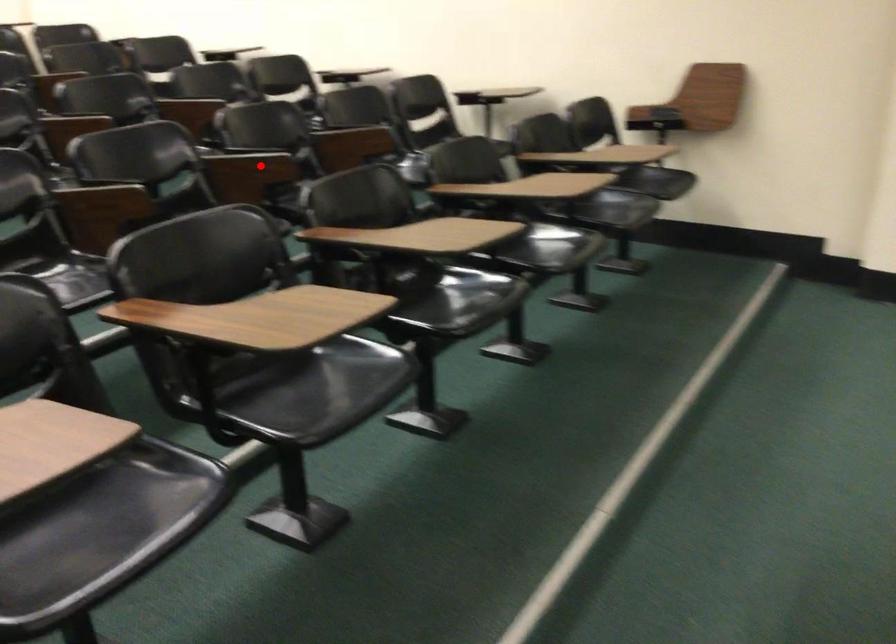
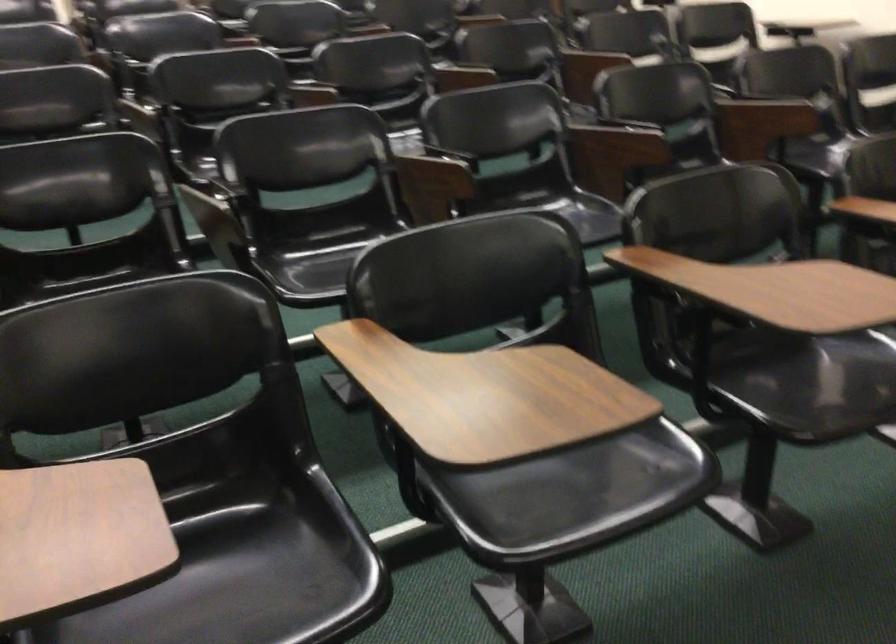
Question: I am providing you with two images of the same scene from different viewpoints. Image1 has a red point marked. In image2, the corresponding 3D location appears at what relative position? Reply with the corresponding letter.

Choices:
 (A) Closer
 (B) Farther

Answer: (A)